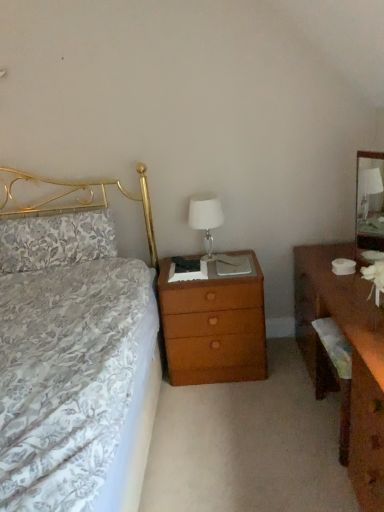
Identify the location of vacant region in front of brown wood nightstand at center. (223, 411).